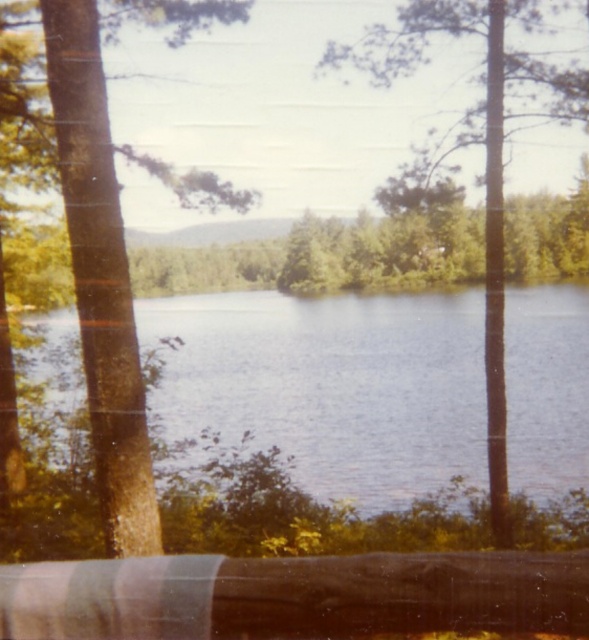
Question: Which point appears closest to the camera in this image?

Choices:
 (A) (517, 422)
 (B) (466, 3)
 (C) (100, 83)

Answer: (C)

Question: Can you confirm if brown textured tree at left is positioned to the left of green leafy tree at center?

Choices:
 (A) no
 (B) yes

Answer: (B)

Question: In this image, where is brown textured tree at left located relative to green leafy tree at center?

Choices:
 (A) above
 (B) below

Answer: (B)

Question: Which object appears farthest from the camera in this image?

Choices:
 (A) green leafy tree at center
 (B) blue water at center
 (C) brown textured tree at left

Answer: (A)

Question: Which of the following is the farthest from the observer?

Choices:
 (A) (104, 218)
 (B) (564, 104)
 (C) (153, 301)

Answer: (C)

Question: Can you confirm if brown textured tree at left is smaller than green leafy tree at center?

Choices:
 (A) no
 (B) yes

Answer: (B)